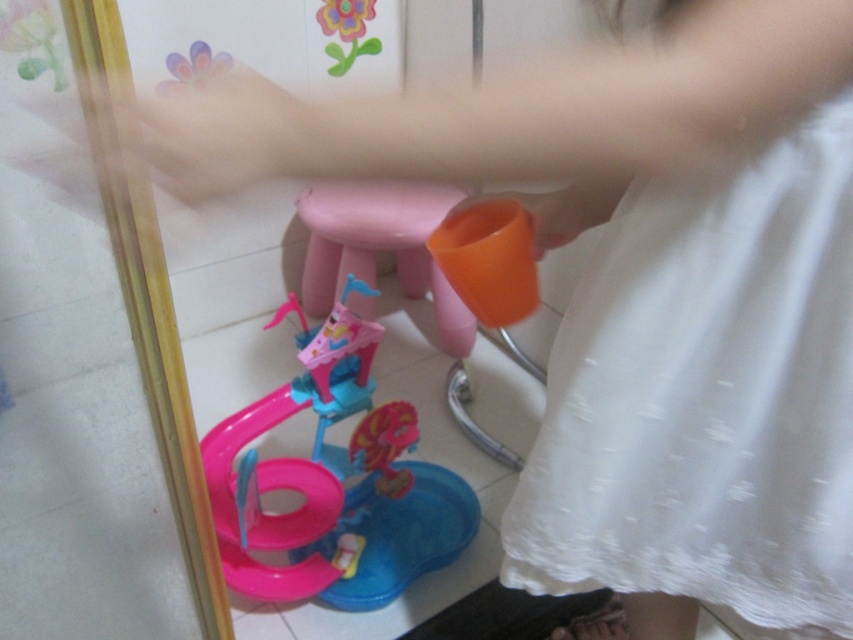
Between pink plastic toy at lower center and pink plastic stool at center, which one appears on the right side from the viewer's perspective?

pink plastic stool at center

Does pink plastic toy at lower center have a lesser width compared to pink plastic stool at center?

Incorrect, pink plastic toy at lower center's width is not less than pink plastic stool at center's.

The height and width of the screenshot is (640, 853). What do you see at coordinates (334, 481) in the screenshot? I see `pink plastic toy at lower center` at bounding box center [334, 481].

This screenshot has width=853, height=640. In order to click on pink plastic toy at lower center in this screenshot , I will do `click(334, 481)`.

Is white lace dress at lower right shorter than pink plastic stool at center?

Incorrect, white lace dress at lower right's height does not fall short of pink plastic stool at center's.

Who is more distant from viewer, (514,554) or (399,224)?

Point (399,224)

Locate an element on the screen. This screenshot has height=640, width=853. white lace dress at lower right is located at coordinates (706, 396).

Who is positioned more to the right, white lace dress at lower right or pink plastic toy at lower center?

white lace dress at lower right

Can you confirm if white lace dress at lower right is positioned to the right of pink plastic toy at lower center?

Yes, white lace dress at lower right is to the right of pink plastic toy at lower center.

Measure the distance between point (819, 406) and camera.

Point (819, 406) is 25.53 inches away from camera.

Locate an element on the screen. The width and height of the screenshot is (853, 640). white lace dress at lower right is located at coordinates (706, 396).